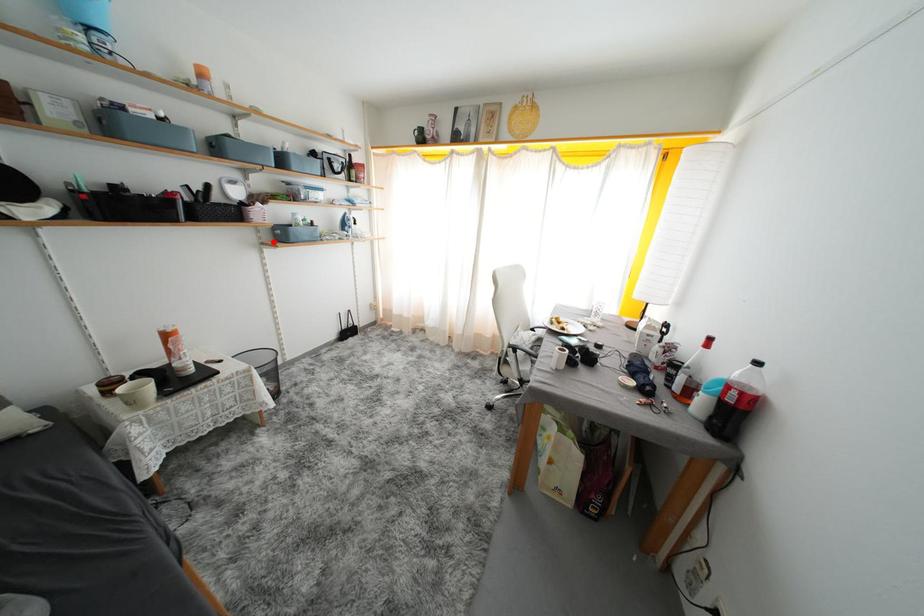
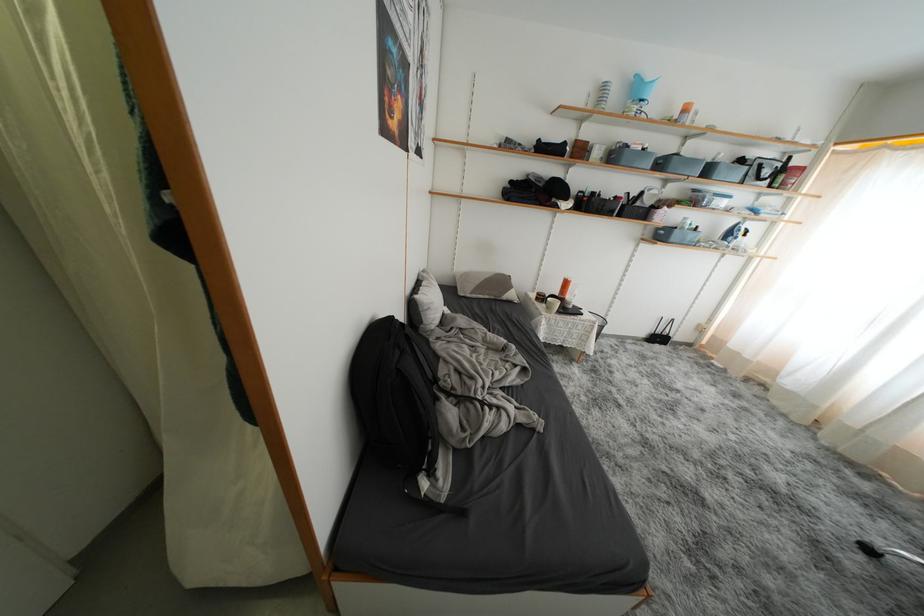
Where in the second image is the point corresponding to the highlighted location from the first image?

(654, 238)